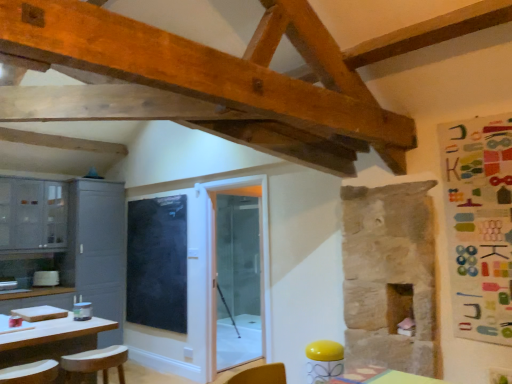
Image resolution: width=512 pixels, height=384 pixels. What do you see at coordinates (32, 213) in the screenshot?
I see `matte gray cabinets at left, which ranks as the first cabinetry in left-to-right order` at bounding box center [32, 213].

What do you see at coordinates (324, 360) in the screenshot? I see `yellow glossy bar stool at lower right` at bounding box center [324, 360].

What do you see at coordinates (98, 250) in the screenshot? The height and width of the screenshot is (384, 512). I see `matte gray cabinet at left, the second cabinetry in the left-to-right sequence` at bounding box center [98, 250].

You are a GUI agent. You are given a task and a screenshot of the screen. Output one action in this format:
    pyautogui.click(x=<x>, y=<y>)
    Task: Click on the black matte chalkboard at center
    The height and width of the screenshot is (384, 512).
    Given the screenshot: What is the action you would take?
    pyautogui.click(x=157, y=263)

This screenshot has height=384, width=512. What are the coordinates of `wooden stool at lower left` in the screenshot? It's located at (96, 362).

How different are the orientations of colorful fabric bulletin board at right and black matte chalkboard at center in degrees?

0.128 degrees.

Which object is closer to the camera, colorful fabric bulletin board at right or black matte chalkboard at center?

colorful fabric bulletin board at right is closer to the camera.

Choose the correct answer: Is colorful fabric bulletin board at right inside black matte chalkboard at center or outside it?

colorful fabric bulletin board at right is not inside black matte chalkboard at center, it's outside.

Is colorful fabric bulletin board at right far away from black matte chalkboard at center?

Yes, colorful fabric bulletin board at right is far from black matte chalkboard at center.

Does matte gray cabinets at left, which ranks as the first cabinetry in left-to-right order, have a greater width compared to yellow glossy bar stool at lower right?

Indeed, matte gray cabinets at left, which ranks as the first cabinetry in left-to-right order, has a greater width compared to yellow glossy bar stool at lower right.

From the picture: Considering the sizes of objects matte gray cabinets at left, which ranks as the first cabinetry in left-to-right order, and yellow glossy bar stool at lower right in the image provided, who is taller, matte gray cabinets at left, which ranks as the first cabinetry in left-to-right order, or yellow glossy bar stool at lower right?

With more height is matte gray cabinets at left, which ranks as the first cabinetry in left-to-right order.

Looking at this image, is matte gray cabinets at left, placed as the 2th cabinetry when sorted from right to left, located outside yellow glossy bar stool at lower right?

Yes, matte gray cabinets at left, placed as the 2th cabinetry when sorted from right to left, is outside of yellow glossy bar stool at lower right.

Consider the image. From a real-world perspective, does transparent glass door at center sit lower than matte gray cabinet at left, the second cabinetry in the left-to-right sequence?

Yes, from a real-world perspective, transparent glass door at center is below matte gray cabinet at left, the second cabinetry in the left-to-right sequence.

Does transparent glass door at center come behind matte gray cabinet at left, the second cabinetry in the left-to-right sequence?

No, it is not.

Is transparent glass door at center turned away from matte gray cabinet at left, the second cabinetry in the left-to-right sequence?

No, matte gray cabinet at left, the second cabinetry in the left-to-right sequence, is not at the back of transparent glass door at center.

What's the angular difference between matte gray cabinet at left, the second cabinetry in the left-to-right sequence, and yellow glossy bar stool at lower right's facing directions?

The angle between the facing direction of matte gray cabinet at left, the second cabinetry in the left-to-right sequence, and the facing direction of yellow glossy bar stool at lower right is 89.8 degrees.

From a real-world perspective, does matte gray cabinet at left, the second cabinetry in the left-to-right sequence, stand above yellow glossy bar stool at lower right?

Indeed, from a real-world perspective, matte gray cabinet at left, the second cabinetry in the left-to-right sequence, stands above yellow glossy bar stool at lower right.

Can you confirm if matte gray cabinet at left, the second cabinetry in the left-to-right sequence, is bigger than yellow glossy bar stool at lower right?

Yes, matte gray cabinet at left, the second cabinetry in the left-to-right sequence, is bigger than yellow glossy bar stool at lower right.

Identify the location of bar stool lying in front of the matte gray cabinet at left, the second cabinetry in the left-to-right sequence. (324, 360).

Would you say black matte chalkboard at center is outside yellow glossy bar stool at lower right?

black matte chalkboard at center lies outside yellow glossy bar stool at lower right's area.

From the image's perspective, would you say black matte chalkboard at center is shown under yellow glossy bar stool at lower right?

Actually, black matte chalkboard at center appears above yellow glossy bar stool at lower right in the image.

Is black matte chalkboard at center bigger or smaller than yellow glossy bar stool at lower right?

In the image, black matte chalkboard at center appears to be larger than yellow glossy bar stool at lower right.

Image resolution: width=512 pixels, height=384 pixels. Find the location of `window screen behind the yellow glossy bar stool at lower right`. window screen behind the yellow glossy bar stool at lower right is located at coordinates (157, 263).

From the picture: Is transparent glass door at center in front of matte gray cabinets at left, placed as the 2th cabinetry when sorted from right to left?

Yes, the depth of transparent glass door at center is less than that of matte gray cabinets at left, placed as the 2th cabinetry when sorted from right to left.

From a real-world perspective, which object stands above the other?

In real-world perspective, matte gray cabinets at left, placed as the 2th cabinetry when sorted from right to left, is above.

Is transparent glass door at center at the left side of matte gray cabinets at left, placed as the 2th cabinetry when sorted from right to left?

Incorrect, transparent glass door at center is not on the left side of matte gray cabinets at left, placed as the 2th cabinetry when sorted from right to left.

Are transparent glass door at center and matte gray cabinets at left, which ranks as the first cabinetry in left-to-right order, far apart?

transparent glass door at center is far away from matte gray cabinets at left, which ranks as the first cabinetry in left-to-right order.

From the image's perspective, does wooden stool at lower left appear lower than colorful fabric bulletin board at right?

Yes.

At what (x,y) coordinates should I click in order to perform the action: click on chair that is under the colorful fabric bulletin board at right (from a real-world perspective). Please return your answer as a coordinate pair (x, y). The image size is (512, 384). Looking at the image, I should click on (96, 362).

Considering the sizes of objects wooden stool at lower left and colorful fabric bulletin board at right in the image provided, who is taller, wooden stool at lower left or colorful fabric bulletin board at right?

Standing taller between the two is colorful fabric bulletin board at right.

Does point (114, 360) lie behind point (482, 194)?

Yes, it is behind point (482, 194).

Image resolution: width=512 pixels, height=384 pixels. I want to click on bulletin board lying in front of the black matte chalkboard at center, so click(x=479, y=225).

Identify the location of the 1st cabinetry behind the yellow glossy bar stool at lower right. (32, 213).

Considering their positions, is yellow glossy bar stool at lower right positioned further to matte gray cabinet at left, acting as the 1th cabinetry starting from the right, than colorful fabric bulletin board at right?

colorful fabric bulletin board at right lies further to matte gray cabinet at left, acting as the 1th cabinetry starting from the right, than the other object.

Based on their spatial positions, is transparent glass door at center or black matte chalkboard at center further from wooden stool at lower left?

Among the two, transparent glass door at center is located further to wooden stool at lower left.

Which object lies nearer to the anchor point black matte chalkboard at center, matte gray cabinets at left, placed as the 2th cabinetry when sorted from right to left, or wooden stool at lower left?

Based on the image, matte gray cabinets at left, placed as the 2th cabinetry when sorted from right to left, appears to be nearer to black matte chalkboard at center.

Estimate the real-world distances between objects in this image. Which object is further from yellow glossy bar stool at lower right, matte gray cabinets at left, placed as the 2th cabinetry when sorted from right to left, or matte gray cabinet at left, the second cabinetry in the left-to-right sequence?

Among the two, matte gray cabinets at left, placed as the 2th cabinetry when sorted from right to left, is located further to yellow glossy bar stool at lower right.

Considering their positions, is transparent glass door at center positioned closer to matte gray cabinet at left, the second cabinetry in the left-to-right sequence, than wooden stool at lower left?

transparent glass door at center.

Looking at the image, which one is located further to transparent glass door at center, colorful fabric bulletin board at right or matte gray cabinet at left, the second cabinetry in the left-to-right sequence?

Among the two, colorful fabric bulletin board at right is located further to transparent glass door at center.

Looking at the image, which one is located further to matte gray cabinets at left, placed as the 2th cabinetry when sorted from right to left, wooden stool at lower left or matte gray cabinet at left, acting as the 1th cabinetry starting from the right?

wooden stool at lower left is positioned further to the anchor matte gray cabinets at left, placed as the 2th cabinetry when sorted from right to left.

Looking at the image, which one is located further to yellow glossy bar stool at lower right, colorful fabric bulletin board at right or wooden stool at lower left?

wooden stool at lower left lies further to yellow glossy bar stool at lower right than the other object.

The height and width of the screenshot is (384, 512). Identify the location of window screen between matte gray cabinet at left, the second cabinetry in the left-to-right sequence, and yellow glossy bar stool at lower right. (157, 263).

At what (x,y) coordinates should I click in order to perform the action: click on cabinetry between matte gray cabinets at left, which ranks as the first cabinetry in left-to-right order, and black matte chalkboard at center. Please return your answer as a coordinate pair (x, y). The width and height of the screenshot is (512, 384). Looking at the image, I should click on (98, 250).

This screenshot has width=512, height=384. What are the coordinates of `glass door between colorful fabric bulletin board at right and black matte chalkboard at center along the z-axis` in the screenshot? It's located at (240, 273).

What are the coordinates of `bar stool between matte gray cabinets at left, which ranks as the first cabinetry in left-to-right order, and colorful fabric bulletin board at right` in the screenshot? It's located at (324, 360).